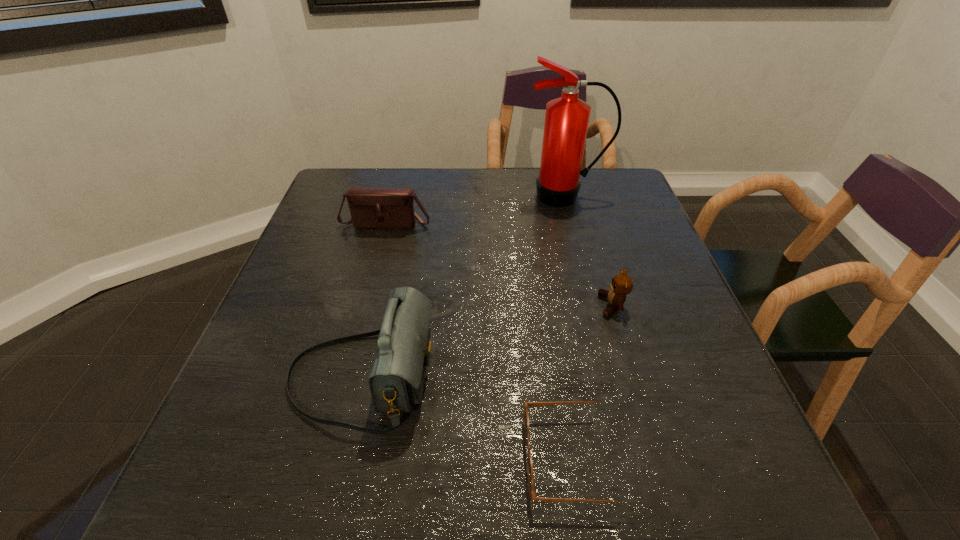
In the image, there is a desktop. Where is `vacant space at the near right corner`? This screenshot has height=540, width=960. vacant space at the near right corner is located at coordinates (704, 511).

This screenshot has height=540, width=960. I want to click on vacant space that is in between the tallest object and the shortest object, so click(570, 327).

You are a GUI agent. You are given a task and a screenshot of the screen. Output one action in this format:
    pyautogui.click(x=<x>, y=<y>)
    Task: Click on the vacant area between the nearer shoulder bag and the fire extinguisher
    This screenshot has height=540, width=960.
    Given the screenshot: What is the action you would take?
    pyautogui.click(x=464, y=287)

Identify the location of free area in between the farther shoulder bag and the nearer shoulder bag. The image size is (960, 540). (374, 300).

Identify the location of vacant space that is in between the third nearest object and the fourth shortest object. (487, 341).

Where is `free space between the fire extinguisher and the shorter shoulder bag`? This screenshot has height=540, width=960. free space between the fire extinguisher and the shorter shoulder bag is located at coordinates (476, 210).

This screenshot has width=960, height=540. I want to click on unoccupied position between the tallest object and the taller shoulder bag, so click(x=464, y=287).

You are a GUI agent. You are given a task and a screenshot of the screen. Output one action in this format:
    pyautogui.click(x=<x>, y=<y>)
    Task: Click on the vacant region between the nearer shoulder bag and the teddy bear
    This screenshot has height=540, width=960.
    Given the screenshot: What is the action you would take?
    pyautogui.click(x=487, y=341)

The width and height of the screenshot is (960, 540). What are the coordinates of `free point between the sunglasses and the second tallest object` in the screenshot? It's located at (468, 417).

Identify the location of free space between the tallest object and the fourth shortest object. The width and height of the screenshot is (960, 540). (464, 287).